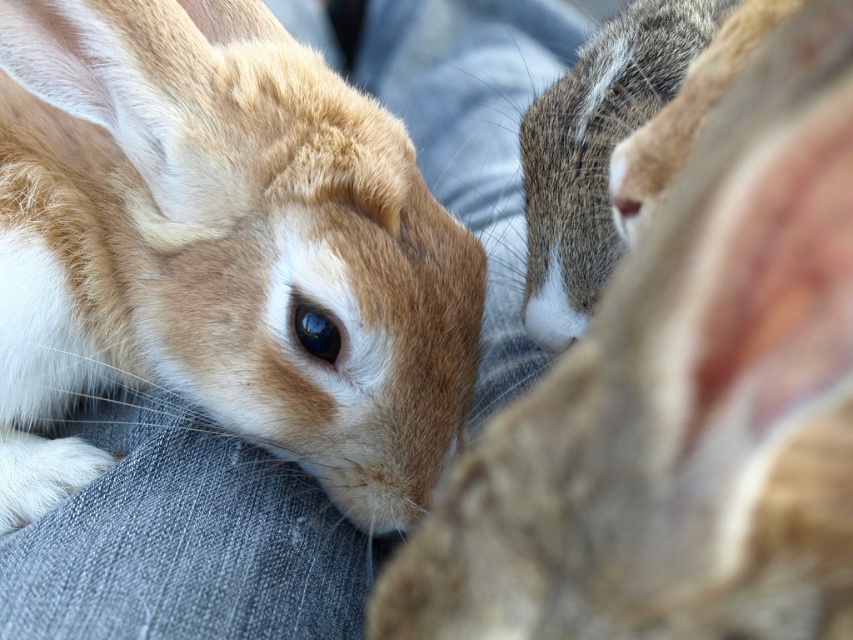
You are a photographer trying to capture a clear shot of both rabbits. Given that your camera can only focus on one rabbit at a time, which rabbit should you focus on to ensure the golden fur rabbit at center and the soft brown fur at center are both in focus?

The golden fur rabbit at center might be wider than soft brown fur at center, so focusing on the wider rabbit could help both be in focus as it occupies more of the frame.

You are a photographer trying to capture a close shot of both the golden fur rabbit at center and the soft brown fur at center. Given that your camera can focus on objects within a 20 inch range, will you be able to get both rabbits in focus?

The distance between the golden fur rabbit at center and the soft brown fur at center is 22.20 inches, which exceeds the camera focus range of 20 inches. Therefore, both rabbits cannot be in focus simultaneously.

You are taking a photo of two rabbits. The first rabbit is at point (90, 49) and the second rabbit is at point (724, 564). Which rabbit is closer to the camera?

The rabbit at point (90, 49) is closer to the camera than the rabbit at point (724, 564).